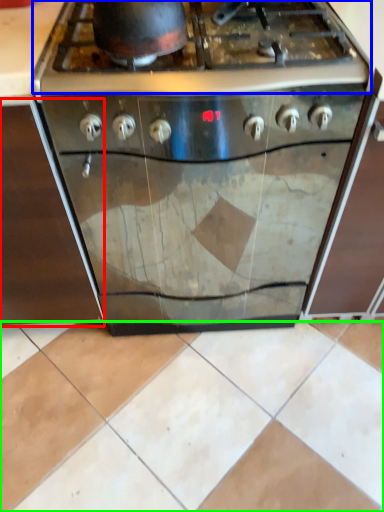
Question: Based on their relative distances, which object is farther from cabinetry (highlighted by a red box)? Choose from gas stove (highlighted by a blue box) and ceramic tile (highlighted by a green box).

Choices:
 (A) gas stove
 (B) ceramic tile

Answer: (B)